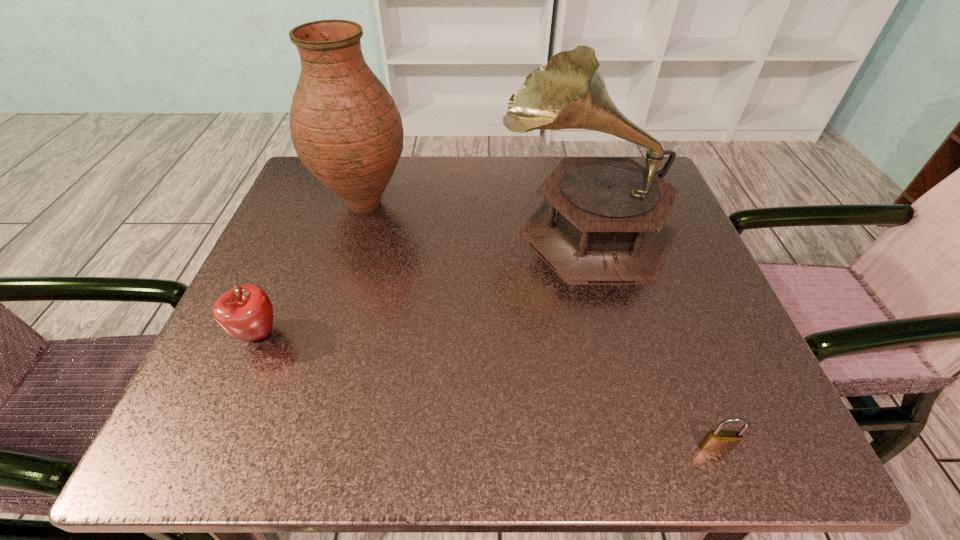
This screenshot has height=540, width=960. Find the location of `vacant space that satisfies the following two spatial constraints: 1. on the horn direction of the phonograph record; 2. on the front side of the third tallest object`. vacant space that satisfies the following two spatial constraints: 1. on the horn direction of the phonograph record; 2. on the front side of the third tallest object is located at coordinates (614, 335).

Image resolution: width=960 pixels, height=540 pixels. I want to click on vacant space that satisfies the following two spatial constraints: 1. on the horn direction of the phonograph record; 2. on the front side of the second shortest object, so click(x=614, y=335).

Locate an element on the screen. Image resolution: width=960 pixels, height=540 pixels. free spot that satisfies the following two spatial constraints: 1. on the back side of the nearest object; 2. on the horn direction of the phonograph record is located at coordinates point(632,226).

Where is `vacant space that satisfies the following two spatial constraints: 1. on the front side of the vase; 2. on the right side of the nearest object`? The width and height of the screenshot is (960, 540). vacant space that satisfies the following two spatial constraints: 1. on the front side of the vase; 2. on the right side of the nearest object is located at coordinates (292, 448).